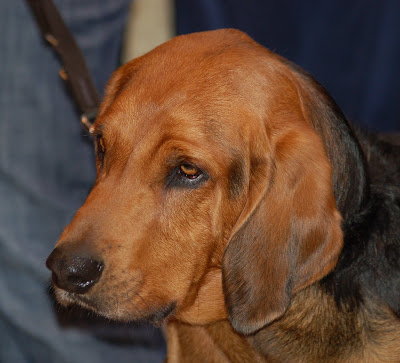
Where is `blue curtain`? Image resolution: width=400 pixels, height=363 pixels. blue curtain is located at coordinates (354, 66).